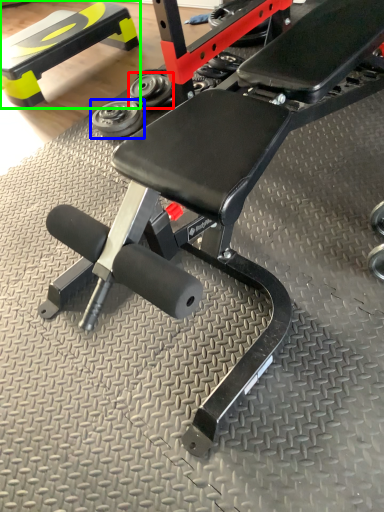
Question: Which is farther away from dumbbell (highlighted by a red box)? dumbbell (highlighted by a blue box) or bench (highlighted by a green box)?

Choices:
 (A) dumbbell
 (B) bench

Answer: (B)